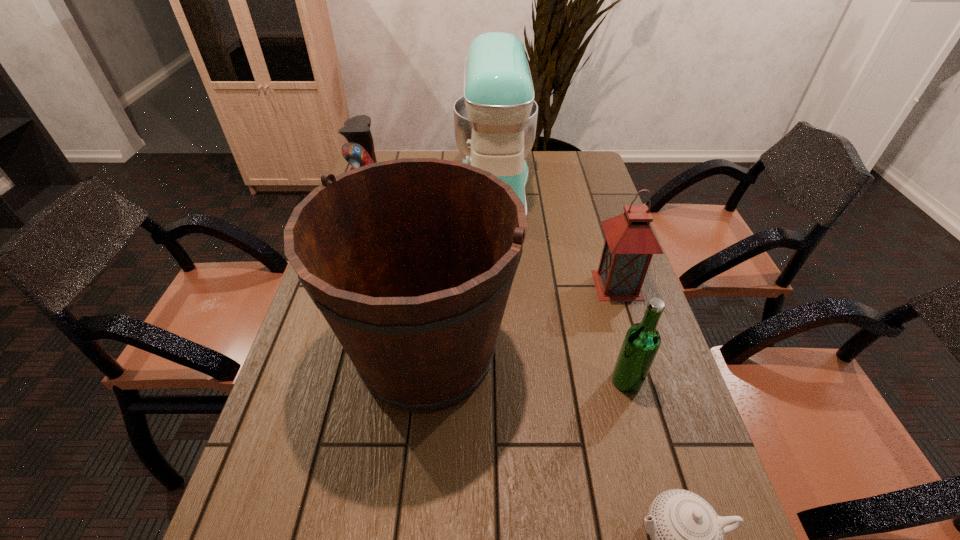
Where is `mixer`? The width and height of the screenshot is (960, 540). mixer is located at coordinates (495, 120).

You are a GUI agent. You are given a task and a screenshot of the screen. Output one action in this format:
    pyautogui.click(x=<x>, y=<y>)
    Task: Click on the bucket
    
    Given the screenshot: What is the action you would take?
    pyautogui.click(x=411, y=261)

Find the location of a particular element. lantern is located at coordinates (630, 243).

At what (x,y) coordinates should I click in order to perform the action: click on parrot. Please return your answer as a coordinate pair (x, y). This screenshot has height=540, width=960. Looking at the image, I should click on (359, 152).

This screenshot has height=540, width=960. I want to click on beer bottle, so click(642, 341).

At what (x,y) coordinates should I click in order to perform the action: click on free space located at the base of the mixer. Please return your answer as a coordinate pair (x, y). Looking at the image, I should click on (430, 190).

The height and width of the screenshot is (540, 960). I want to click on free spot located at the base of the mixer, so click(x=354, y=190).

The height and width of the screenshot is (540, 960). I want to click on vacant space located 0.280m at the base of the mixer, so click(x=377, y=190).

This screenshot has width=960, height=540. Find the location of `free space located 0.130m on the back of the bucket`. free space located 0.130m on the back of the bucket is located at coordinates (437, 260).

Where is `vacant region located 0.250m on the front of the lantern`? This screenshot has width=960, height=540. vacant region located 0.250m on the front of the lantern is located at coordinates (648, 382).